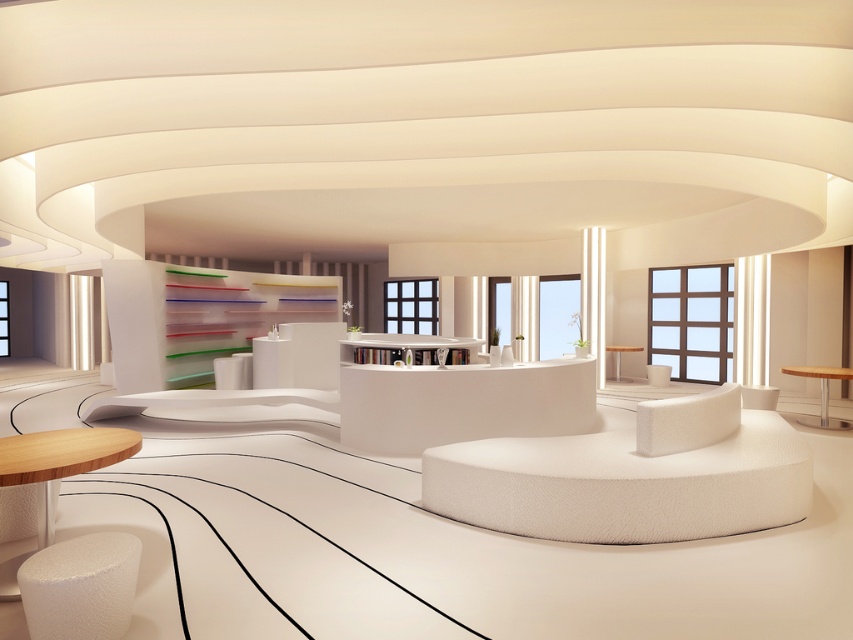
Question: Which point is farther from the camera taking this photo?

Choices:
 (A) (47, 438)
 (B) (813, 368)

Answer: (B)

Question: Does white matte/soft table at center have a smaller size compared to light brown wood table at lower left?

Choices:
 (A) no
 (B) yes

Answer: (A)

Question: Which point appears closest to the camera in this image?

Choices:
 (A) click(619, 349)
 (B) click(44, 620)
 (C) click(399, 444)
 (D) click(840, 374)

Answer: (B)

Question: Can you confirm if satin white stool at lower left is positioned below light brown wood table at lower left?

Choices:
 (A) yes
 (B) no

Answer: (A)

Question: Which point is farther to the camera?

Choices:
 (A) (357, 432)
 (B) (844, 422)
 (C) (614, 346)

Answer: (C)

Question: Is white matte/soft table at center thinner than satin white stool at lower left?

Choices:
 (A) no
 (B) yes

Answer: (A)